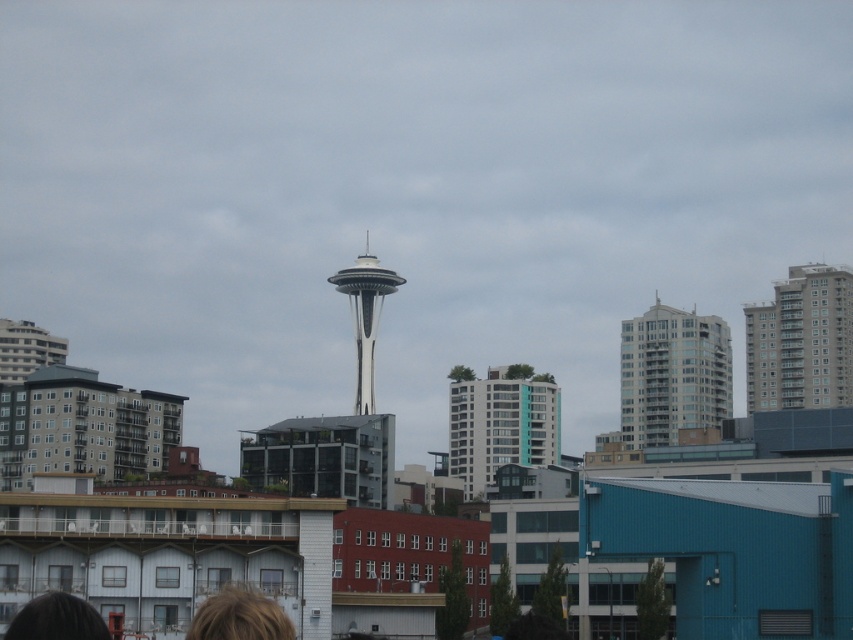
Question: Which point appears closest to the camera in this image?

Choices:
 (A) click(364, 352)
 (B) click(839, 360)

Answer: (B)

Question: Is glassy white building at center above blonde hair at lower center?

Choices:
 (A) no
 (B) yes

Answer: (A)

Question: Is gray concrete building at upper right to the right of brown hair at lower center from the viewer's perspective?

Choices:
 (A) no
 (B) yes

Answer: (B)

Question: Which point appears closest to the camera in this image?

Choices:
 (A) (556, 451)
 (B) (672, 328)
 (C) (45, 605)

Answer: (C)

Question: Is gray concrete building at upper right below glassy white building at center?

Choices:
 (A) no
 (B) yes

Answer: (A)

Question: Which point is closer to the camera?

Choices:
 (A) white glossy space needle at center
 (B) blonde hair at lower center

Answer: (B)